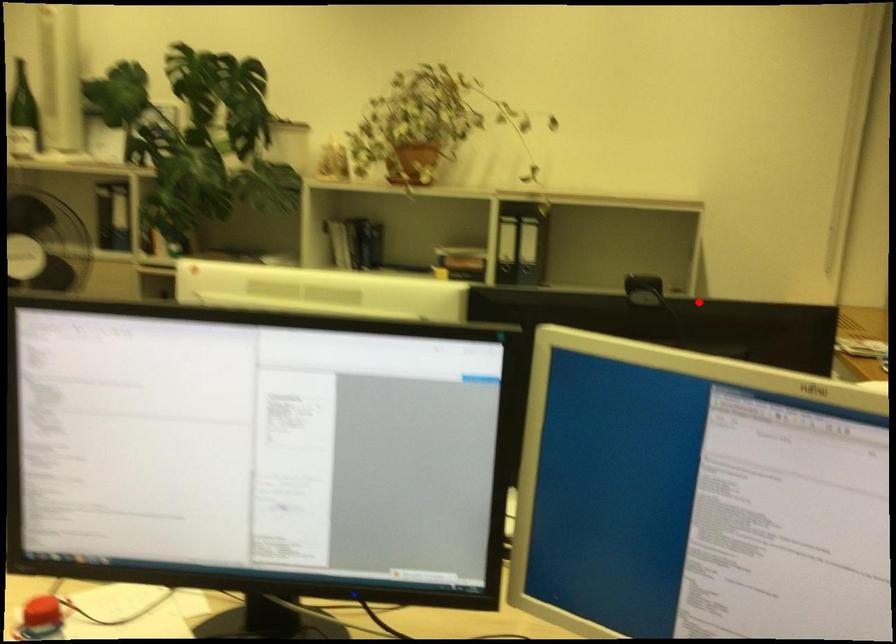
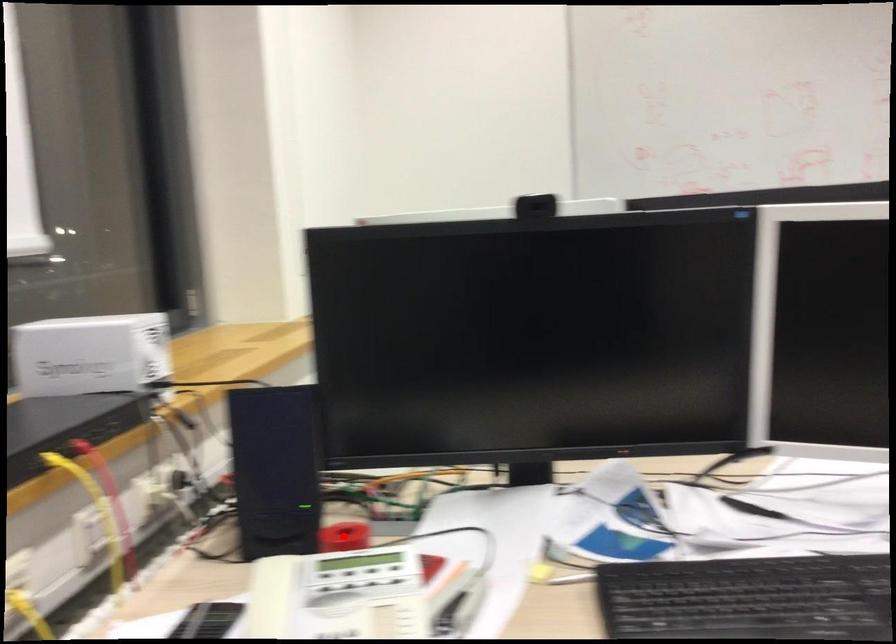
I am providing you with two images of the same scene from different viewpoints. A red point is marked on the first image and another point is marked on the second image. Are the points marked in image1 and image2 representing the same 3D position?

No